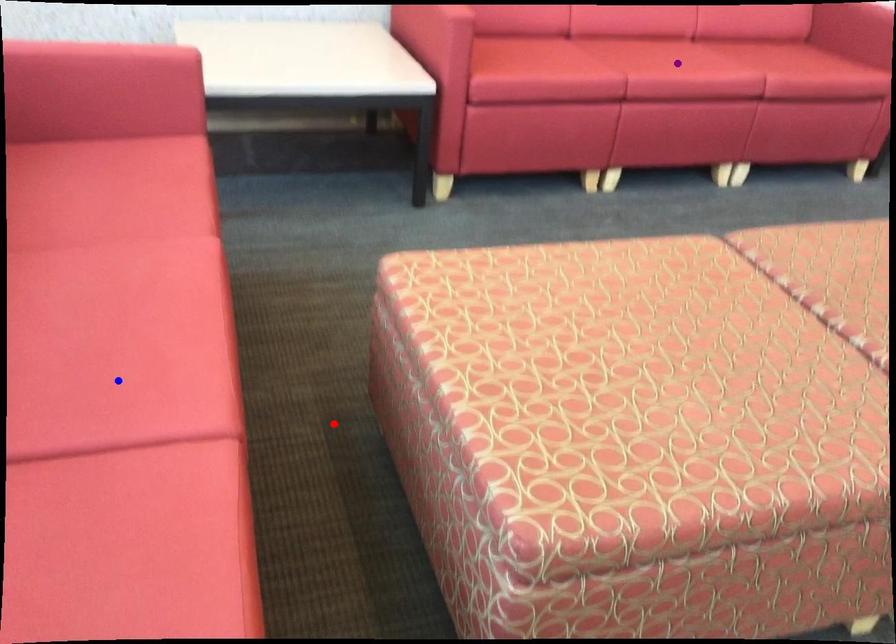
Order these from farthest to nearest:
A) blue point
B) red point
C) purple point

purple point
red point
blue point